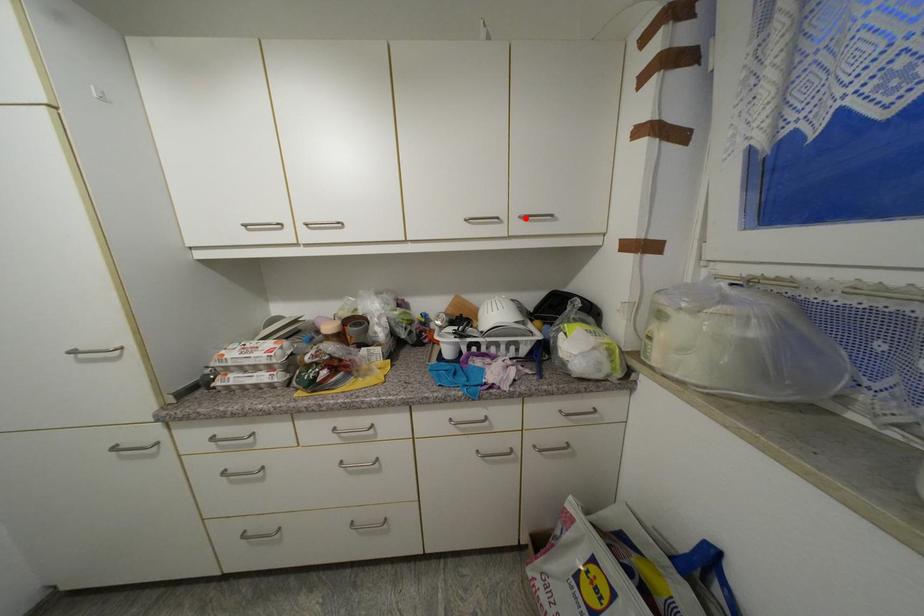
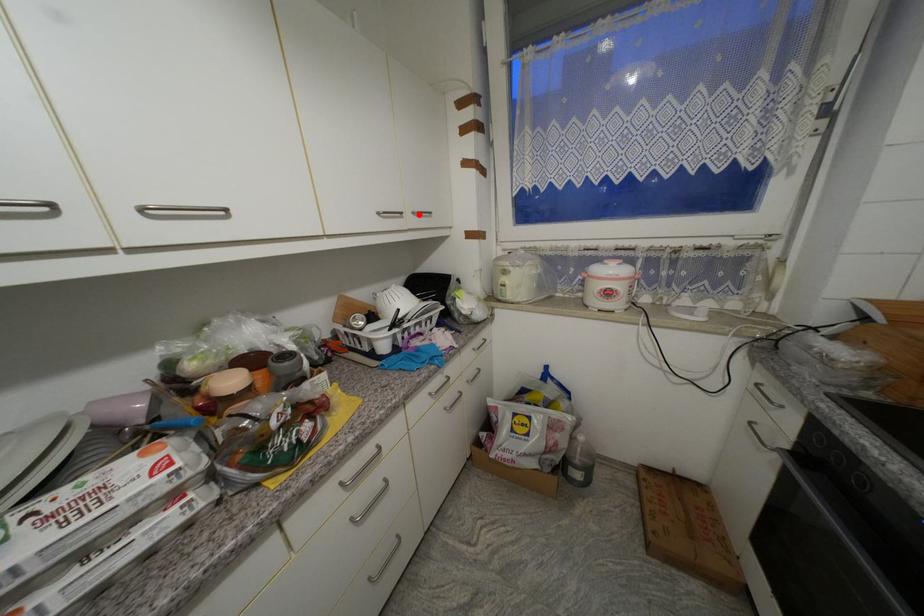
I am providing you with two images of the same scene from different viewpoints. A red point is marked on the first image and another point is marked on the second image. Does the point marked in image1 correspond to the same location as the one in image2?

Yes